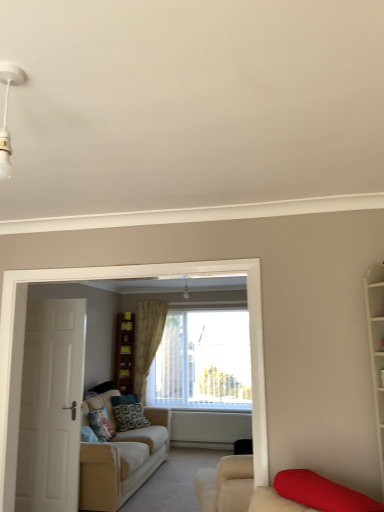
Find the location of a particular element. beige fabric couch at left is located at coordinates (123, 463).

This screenshot has height=512, width=384. I want to click on beige textured curtain at center, so click(x=147, y=340).

I want to click on velvet red cushion at lower right, so click(x=311, y=494).

Looking at this image, measure the distance between point (285,492) and camera.

Point (285,492) is 1.93 meters from camera.

Image resolution: width=384 pixels, height=512 pixels. What do you see at coordinates (51, 406) in the screenshot?
I see `white wooden door at left` at bounding box center [51, 406].

This screenshot has width=384, height=512. In order to click on white wooden door at left in this screenshot , I will do `click(51, 406)`.

In order to click on beige fabric couch at left in this screenshot , I will do `click(123, 463)`.

From the image's perspective, which object appears higher, patterned fabric pillow at center, the second pillow from the back, or white plastic light fixture at upper left?

white plastic light fixture at upper left appears higher in the image.

Is patterned fabric pillow at center, the second pillow from the back, spatially inside white plastic light fixture at upper left, or outside of it?

patterned fabric pillow at center, the second pillow from the back, is located beyond the bounds of white plastic light fixture at upper left.

Based on their sizes in the image, would you say patterned fabric pillow at center, the second pillow from the back, is bigger or smaller than white plastic light fixture at upper left?

Clearly, patterned fabric pillow at center, the second pillow from the back, is larger in size than white plastic light fixture at upper left.

Can you tell me how much patterned fabric pillow at center, acting as the 1th pillow starting from the front, and white plastic light fixture at upper left differ in facing direction?

The facing directions of patterned fabric pillow at center, acting as the 1th pillow starting from the front, and white plastic light fixture at upper left are 101 degrees apart.

Consider the image. Which of these two, wooden bookshelf at center, which is the 2th shelf from bottom to top, or patterned fabric pillow at center, the second pillow from the back, is thinner?

Thinner between the two is wooden bookshelf at center, which is the 2th shelf from bottom to top.

Who is taller, wooden bookshelf at center, which is the 2th shelf from bottom to top, or patterned fabric pillow at center, acting as the 1th pillow starting from the front?

With more height is patterned fabric pillow at center, acting as the 1th pillow starting from the front.

Considering the relative positions of wooden bookshelf at center, the first shelf positioned from the top, and patterned fabric pillow at center, the second pillow from the back, in the image provided, is wooden bookshelf at center, the first shelf positioned from the top, to the left of patterned fabric pillow at center, the second pillow from the back, from the viewer's perspective?

No, wooden bookshelf at center, the first shelf positioned from the top, is not to the left of patterned fabric pillow at center, the second pillow from the back.

From a real-world perspective, does wooden bookshelf at center, placed as the first shelf when sorted from bottom to top, stand above white matte radiator at center?

Yes, from a real-world perspective, wooden bookshelf at center, placed as the first shelf when sorted from bottom to top, is over white matte radiator at center

How many degrees apart are the facing directions of wooden bookshelf at center, placed as the first shelf when sorted from bottom to top, and white matte radiator at center?

They differ by 38.8 degrees in their facing directions.

Is wooden bookshelf at center, placed as the first shelf when sorted from bottom to top, located outside white matte radiator at center?

wooden bookshelf at center, placed as the first shelf when sorted from bottom to top, is positioned outside white matte radiator at center.

Which object is closer to the camera taking this photo, wooden bookshelf at center, the second shelf in the top-to-bottom sequence, or white matte radiator at center?

Positioned in front is white matte radiator at center.

Is white wooden door at left oriented away from wooden bookshelf at center, placed as the first shelf when sorted from bottom to top?

Yes.

Is white wooden door at left not within wooden bookshelf at center, the second shelf in the top-to-bottom sequence?

white wooden door at left lies outside wooden bookshelf at center, the second shelf in the top-to-bottom sequence,'s area.

Between white wooden door at left and wooden bookshelf at center, the second shelf in the top-to-bottom sequence, which one has smaller width?

Thinner between the two is white wooden door at left.

Does white wooden door at left have a lesser height compared to wooden bookshelf at center, the second shelf in the top-to-bottom sequence?

In fact, white wooden door at left may be taller than wooden bookshelf at center, the second shelf in the top-to-bottom sequence.

From the image's perspective, which object appears higher, patterned fabric pillow at center, which is the 1th pillow from back to front, or patterned fabric pillow at center, the second pillow from the back?

patterned fabric pillow at center, the second pillow from the back, is shown above in the image.

From a real-world perspective, which is physically below, patterned fabric pillow at center, which is the 1th pillow from back to front, or patterned fabric pillow at center, the second pillow from the back?

patterned fabric pillow at center, which is the 1th pillow from back to front, from a real-world perspective.

You are a GUI agent. You are given a task and a screenshot of the screen. Output one action in this format:
    pyautogui.click(x=<x>, y=<y>)
    Task: Click on the pillow that appears in front of the patterned fabric pillow at center, which is the 1th pillow from back to front
    This screenshot has height=512, width=384.
    Given the screenshot: What is the action you would take?
    pyautogui.click(x=101, y=424)

Considering the relative sizes of brown wooden bookshelf at center and white matte radiator at center in the image provided, is brown wooden bookshelf at center wider than white matte radiator at center?

Yes.

Which object is more forward, brown wooden bookshelf at center or white matte radiator at center?

white matte radiator at center is more forward.

Considering the sizes of brown wooden bookshelf at center and white matte radiator at center in the image, is brown wooden bookshelf at center bigger or smaller than white matte radiator at center?

Considering their sizes, brown wooden bookshelf at center takes up more space than white matte radiator at center.

Between brown wooden bookshelf at center and white matte radiator at center, which one appears on the right side from the viewer's perspective?

From the viewer's perspective, white matte radiator at center appears more on the right side.

Between beige fabric couch at left and white wooden bookshelf at right, which one has larger size?

With larger size is beige fabric couch at left.

Based on the photo, is beige fabric couch at left positioned with its back to white wooden bookshelf at right?

No, white wooden bookshelf at right is not at the back of beige fabric couch at left.

This screenshot has height=512, width=384. I want to click on bookshelf on the right of beige fabric couch at left, so click(x=376, y=348).

Locate an element on the screen. The width and height of the screenshot is (384, 512). light fixture above the patterned fabric pillow at center, acting as the 1th pillow starting from the front (from a real-world perspective) is located at coordinates (6, 115).

Where is `the 1st pillow below the wooden bookshelf at center, which is the 2th shelf from bottom to top (from the image's perspective)`? The height and width of the screenshot is (512, 384). the 1st pillow below the wooden bookshelf at center, which is the 2th shelf from bottom to top (from the image's perspective) is located at coordinates (101, 424).

From the picture: Estimate the real-world distances between objects in this image. Which object is further from wooden bookshelf at center, the second shelf in the top-to-bottom sequence, white wooden door at left or white matte radiator at center?

The object further to wooden bookshelf at center, the second shelf in the top-to-bottom sequence, is white wooden door at left.

Estimate the real-world distances between objects in this image. Which object is closer to beige textured curtain at center, white wooden door at left or white wooden bookshelf at right?

Among the two, white wooden door at left is located nearer to beige textured curtain at center.

Which object lies nearer to the anchor point brown wooden bookshelf at center, wooden bookshelf at center, the second shelf in the top-to-bottom sequence, or white matte radiator at center?

wooden bookshelf at center, the second shelf in the top-to-bottom sequence, lies closer to brown wooden bookshelf at center than the other object.

Based on their spatial positions, is patterned fabric pillow at center, acting as the 1th pillow starting from the front, or white matte radiator at center closer to white plastic light fixture at upper left?

Among the two, patterned fabric pillow at center, acting as the 1th pillow starting from the front, is located nearer to white plastic light fixture at upper left.

Which object lies nearer to the anchor point patterned fabric pillow at center, acting as the 1th pillow starting from the front, white wooden door at left or white wooden bookshelf at right?

Among the two, white wooden door at left is located nearer to patterned fabric pillow at center, acting as the 1th pillow starting from the front.

When comparing their distances from velvet red cushion at lower right, does wooden bookshelf at center, the second shelf in the top-to-bottom sequence, or patterned fabric pillow at center, acting as the 1th pillow starting from the front, seem further?

wooden bookshelf at center, the second shelf in the top-to-bottom sequence, is positioned further to the anchor velvet red cushion at lower right.

Estimate the real-world distances between objects in this image. Which object is further from velvet red cushion at lower right, patterned fabric pillow at center, acting as the 1th pillow starting from the front, or white wooden bookshelf at right?

patterned fabric pillow at center, acting as the 1th pillow starting from the front, is further to velvet red cushion at lower right.

Considering their positions, is patterned fabric pillow at center, acting as the 1th pillow starting from the front, positioned further to velvet red cushion at lower right than patterned fabric pillow at center, the 2th pillow in the front-to-back sequence?

patterned fabric pillow at center, the 2th pillow in the front-to-back sequence.

The image size is (384, 512). What are the coordinates of `curtain positioned between white wooden bookshelf at right and wooden bookshelf at center, the first shelf positioned from the top, from near to far` in the screenshot? It's located at (147, 340).

The width and height of the screenshot is (384, 512). Identify the location of curtain between patterned fabric pillow at center, the 2th pillow in the front-to-back sequence, and wooden bookshelf at center, the first shelf positioned from the top, from front to back. (147, 340).

Where is `radiator positioned between beige fabric couch at left and wooden bookshelf at center, which is the 2th shelf from bottom to top, from near to far`? Image resolution: width=384 pixels, height=512 pixels. radiator positioned between beige fabric couch at left and wooden bookshelf at center, which is the 2th shelf from bottom to top, from near to far is located at coordinates (209, 428).

What are the coordinates of `studio couch between white plastic light fixture at upper left and wooden bookshelf at center, the first shelf positioned from the top, in the front-back direction` in the screenshot? It's located at (123, 463).